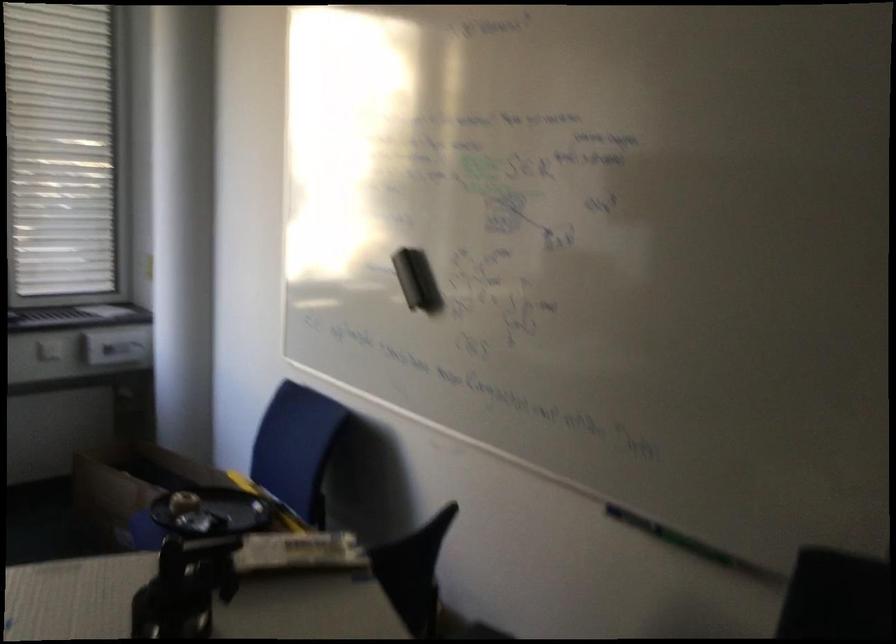
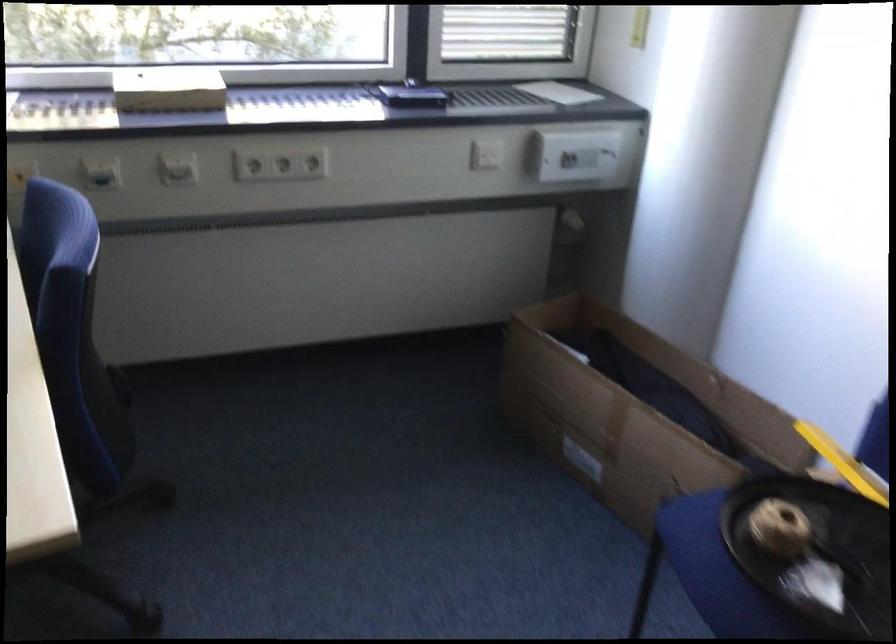
Locate, in the second image, the point that corresponds to pixel 140 516 in the first image.

(695, 527)